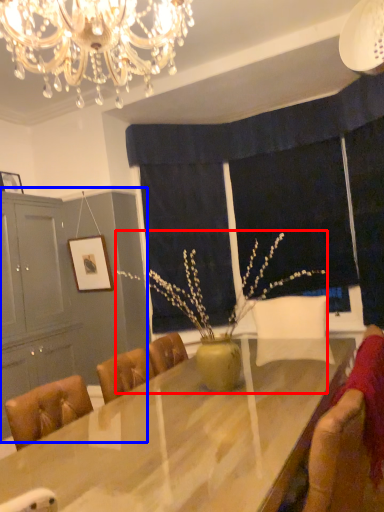
Question: Which object is closer to the camera taking this photo, floral arrangement (highlighted by a red box) or dresser (highlighted by a blue box)?

Choices:
 (A) floral arrangement
 (B) dresser

Answer: (A)